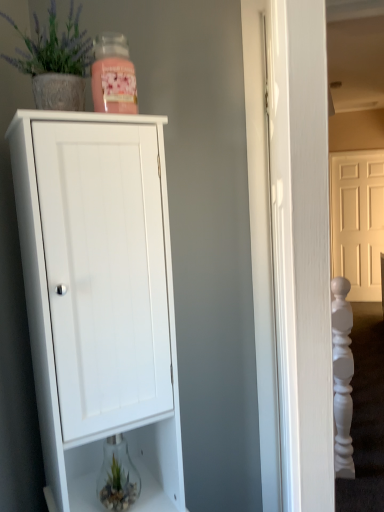
The height and width of the screenshot is (512, 384). I want to click on yellow matte door at upper right, so (x=357, y=221).

What is the approximate width of clear glass vase at lower center?

It is 4.36 inches.

Where is `matte gray pot at upper left`? matte gray pot at upper left is located at coordinates click(54, 47).

Is white matte cabinet at center outside of matte gray pot at upper left?

Yes, white matte cabinet at center is located beyond the bounds of matte gray pot at upper left.

From the image's perspective, which one is positioned lower, white matte cabinet at center or matte gray pot at upper left?

From the image's view, white matte cabinet at center is below.

Considering the positions of point (52, 417) and point (69, 34), is point (52, 417) closer or farther from the camera than point (69, 34)?

Point (52, 417) is positioned closer to the camera compared to point (69, 34).

How many degrees apart are the facing directions of white matte cabinet at center and matte gray pot at upper left?

The facing directions of white matte cabinet at center and matte gray pot at upper left are 1.59 degrees apart.

From the picture: From the image's perspective, between matte gray pot at upper left and clear glass vase at lower center, who is located below?

clear glass vase at lower center.

From the picture: Can you confirm if matte gray pot at upper left is thinner than clear glass vase at lower center?

No, matte gray pot at upper left is not thinner than clear glass vase at lower center.

In the scene shown: From a real-world perspective, is matte gray pot at upper left over clear glass vase at lower center?

Yes, from a real-world perspective, matte gray pot at upper left is over clear glass vase at lower center

How much distance is there between matte gray pot at upper left and clear glass vase at lower center?

They are 97.44 centimeters apart.

From the image's perspective, is white matte cabinet at center positioned above or below clear glass vase at lower center?

From the image's perspective, white matte cabinet at center appears above clear glass vase at lower center.

Is white matte cabinet at center in front of or behind clear glass vase at lower center in the image?

white matte cabinet at center is positioned closer to the viewer than clear glass vase at lower center.

Considering the sizes of white matte cabinet at center and clear glass vase at lower center in the image, is white matte cabinet at center taller or shorter than clear glass vase at lower center?

Clearly, white matte cabinet at center is taller compared to clear glass vase at lower center.

Is clear glass vase at lower center placed right next to matte gray pot at upper left?

No, clear glass vase at lower center is not with matte gray pot at upper left.

Between clear glass vase at lower center and matte gray pot at upper left, which one has more height?

With more height is matte gray pot at upper left.

Is clear glass vase at lower center situated inside matte gray pot at upper left or outside?

clear glass vase at lower center is located beyond the bounds of matte gray pot at upper left.

Where is `plant lying above the clear glass vase at lower center (from the image's perspective)`? This screenshot has width=384, height=512. plant lying above the clear glass vase at lower center (from the image's perspective) is located at coordinates (54, 47).

Looking at their sizes, would you say white matte cabinet at center is wider or thinner than yellow matte door at upper right?

Considering their sizes, white matte cabinet at center looks broader than yellow matte door at upper right.

From the image's perspective, between white matte cabinet at center and yellow matte door at upper right, which one is located above?

From the image's view, yellow matte door at upper right is above.

From a real-world perspective, which is physically above, white matte cabinet at center or yellow matte door at upper right?

In real-world perspective, white matte cabinet at center is above.

What's the angular difference between white matte cabinet at center and yellow matte door at upper right's facing directions?

There is a 38.6-degree angle between the facing directions of white matte cabinet at center and yellow matte door at upper right.

You are a GUI agent. You are given a task and a screenshot of the screen. Output one action in this format:
    pyautogui.click(x=<x>, y=<y>)
    Task: Click on the plant above the yellow matte door at upper right (from the image's perspective)
    The width and height of the screenshot is (384, 512).
    Given the screenshot: What is the action you would take?
    pyautogui.click(x=54, y=47)

Consider the image. Which of these two, matte gray pot at upper left or yellow matte door at upper right, is smaller?

Smaller between the two is matte gray pot at upper left.

From the image's perspective, is matte gray pot at upper left above or below yellow matte door at upper right?

Based on their image positions, matte gray pot at upper left is located above yellow matte door at upper right.

Based on the photo, can you tell me how much yellow matte door at upper right and clear glass vase at lower center differ in facing direction?

The facing directions of yellow matte door at upper right and clear glass vase at lower center are 39.3 degrees apart.

Are yellow matte door at upper right and clear glass vase at lower center far apart?

yellow matte door at upper right is positioned a significant distance from clear glass vase at lower center.

From the image's perspective, is yellow matte door at upper right located beneath clear glass vase at lower center?

No, from the image's perspective, yellow matte door at upper right is not beneath clear glass vase at lower center.

Consider the image. Who is more distant, yellow matte door at upper right or clear glass vase at lower center?

yellow matte door at upper right is further from the camera.

This screenshot has height=512, width=384. I want to click on plant that is above the white matte cabinet at center (from the image's perspective), so click(x=54, y=47).

The image size is (384, 512). I want to click on drawer below the matte gray pot at upper left (from the image's perspective), so click(152, 463).

Looking at the image, which one is located further to white matte cabinet at center, matte gray pot at upper left or yellow matte door at upper right?

Among the two, yellow matte door at upper right is located further to white matte cabinet at center.

Based on their spatial positions, is clear glass vase at lower center or white matte cabinet at center further from yellow matte door at upper right?

white matte cabinet at center.

Based on their spatial positions, is yellow matte door at upper right or clear glass vase at lower center closer to white matte cabinet at center?

clear glass vase at lower center lies closer to white matte cabinet at center than the other object.

Considering their positions, is yellow matte door at upper right positioned closer to white matte cabinet at center than matte gray pot at upper left?

matte gray pot at upper left is closer to white matte cabinet at center.

Which object lies further to the anchor point matte gray pot at upper left, clear glass vase at lower center or yellow matte door at upper right?

Among the two, yellow matte door at upper right is located further to matte gray pot at upper left.

When comparing their distances from clear glass vase at lower center, does matte gray pot at upper left or white matte cabinet at center seem further?

matte gray pot at upper left is positioned further to the anchor clear glass vase at lower center.

Estimate the real-world distances between objects in this image. Which object is closer to white matte cabinet at center, clear glass vase at lower center or matte gray pot at upper left?

The object closer to white matte cabinet at center is clear glass vase at lower center.

Which object lies further to the anchor point matte gray pot at upper left, yellow matte door at upper right or clear glass vase at lower center?

Among the two, yellow matte door at upper right is located further to matte gray pot at upper left.

The height and width of the screenshot is (512, 384). I want to click on drawer between white matte cabinet at center and yellow matte door at upper right from front to back, so click(x=152, y=463).

Identify the location of cupboard that lies between matte gray pot at upper left and clear glass vase at lower center from top to bottom. (99, 298).

At what (x,y) coordinates should I click in order to perform the action: click on drawer between matte gray pot at upper left and yellow matte door at upper right from front to back. Please return your answer as a coordinate pair (x, y). The height and width of the screenshot is (512, 384). Looking at the image, I should click on (152, 463).

Image resolution: width=384 pixels, height=512 pixels. I want to click on plant between white matte cabinet at center and yellow matte door at upper right from front to back, so click(54, 47).